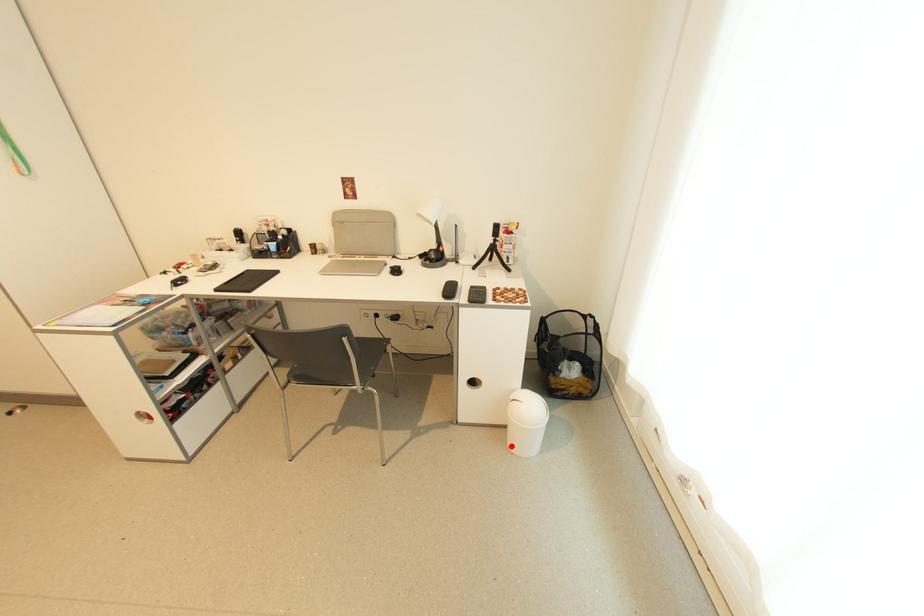
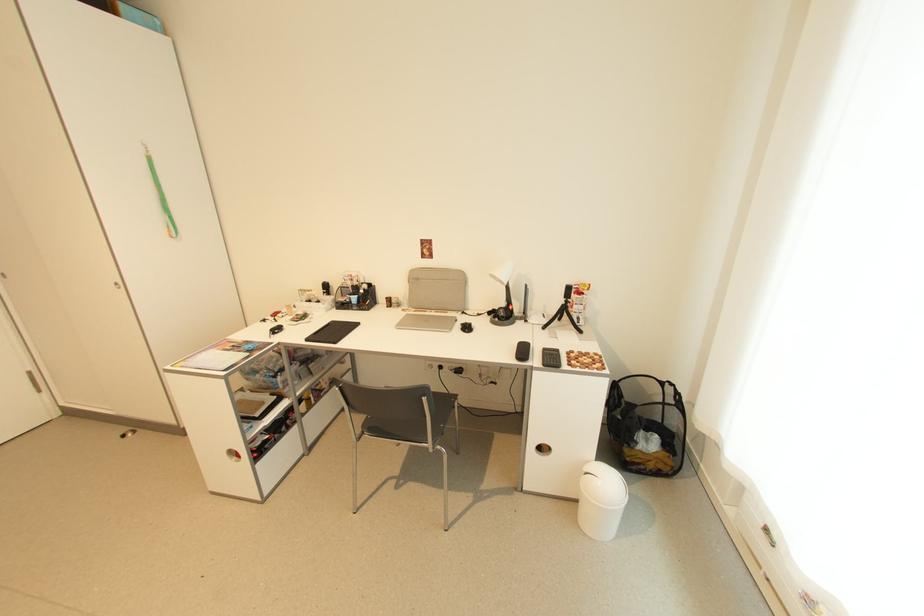
Where in the second image is the point corresponding to the highlighted location from the first image?

(581, 524)